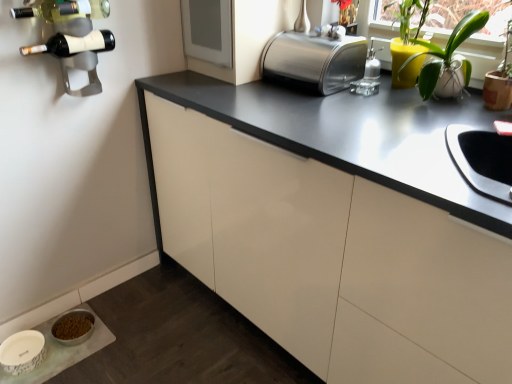
This screenshot has width=512, height=384. Find the location of `vacant space situated above white glossy pet food bowl at lower left (from a real-world perspective)`. vacant space situated above white glossy pet food bowl at lower left (from a real-world perspective) is located at coordinates (42, 341).